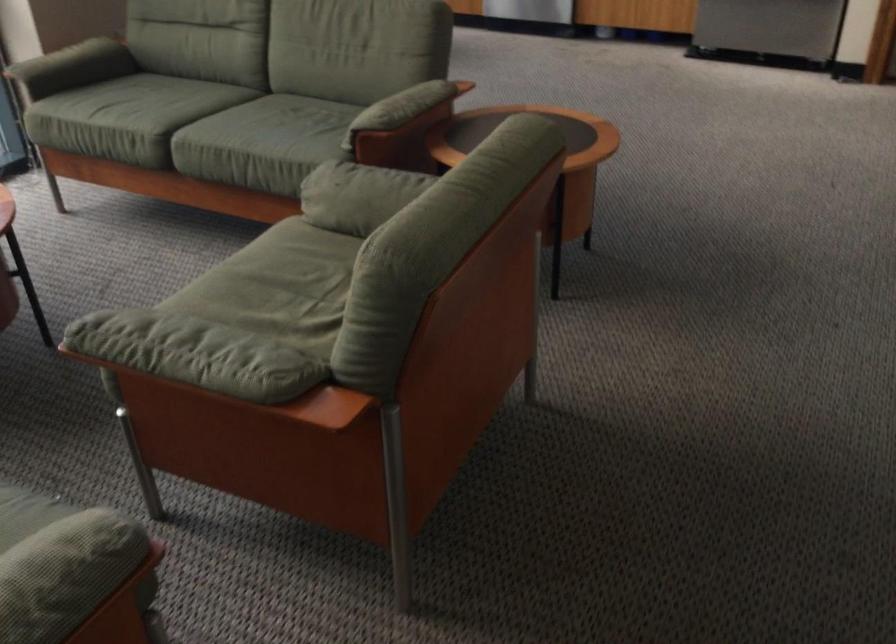
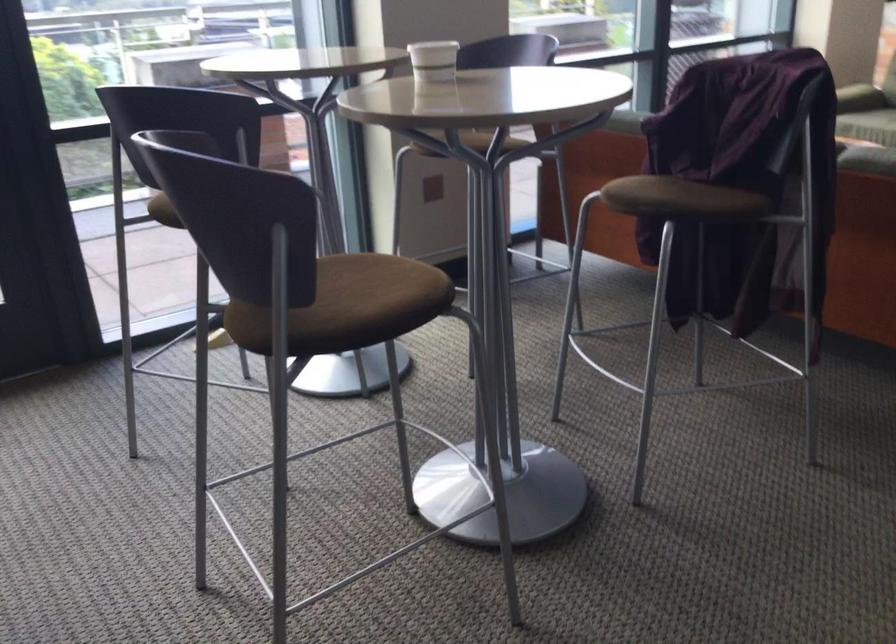
Question: I am providing you with two images of the same scene from different viewpoints. Which of the following objects are not visible in image2?

Choices:
 (A) shower temperature knob
 (B) green sofa sitting surface
 (C) brown chair sitting surface
 (D) white paper cup

Answer: (B)